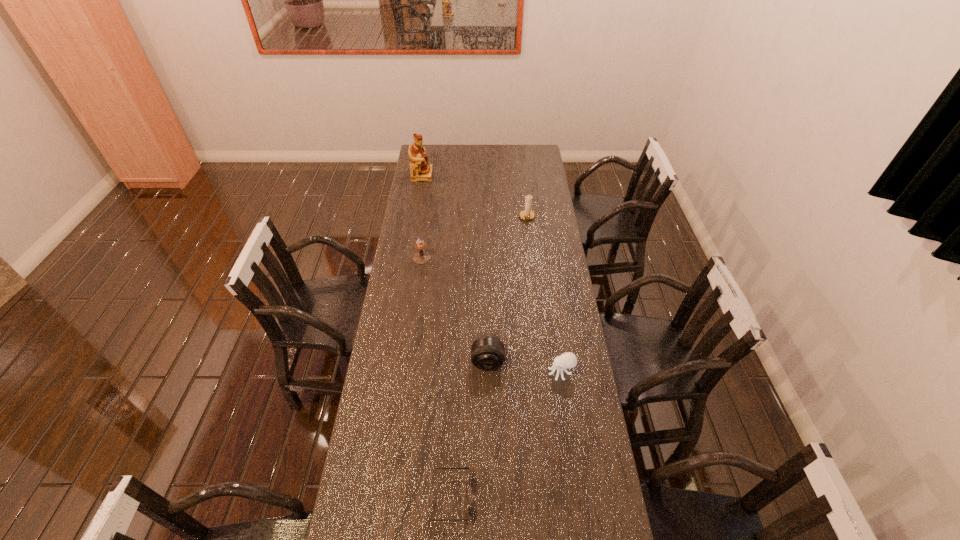
The width and height of the screenshot is (960, 540). What are the coordinates of `candle holder at the right edge` in the screenshot? It's located at (527, 214).

This screenshot has height=540, width=960. Identify the location of octopus present at the right edge. pyautogui.click(x=567, y=360).

I want to click on vacant position at the left edge of the desktop, so tap(409, 279).

The image size is (960, 540). What are the coordinates of `free spot at the right edge of the desktop` in the screenshot? It's located at (534, 299).

What are the coordinates of `vacant space at the far left corner of the desktop` in the screenshot? It's located at (443, 145).

Identify the location of free point between the second farthest object and the telephoto lens. The image size is (960, 540). (508, 289).

Find the location of a particular element. This screenshot has height=540, width=960. free space between the telephoto lens and the shortest object is located at coordinates click(x=469, y=429).

In order to click on empty space between the figurine and the nearest object in this screenshot , I will do `click(437, 336)`.

Identify the location of empty space between the sunglasses and the farthest object. This screenshot has width=960, height=540. (437, 336).

Where is `unoccupied position between the shortest object and the tallest object`? This screenshot has height=540, width=960. unoccupied position between the shortest object and the tallest object is located at coordinates (437, 336).